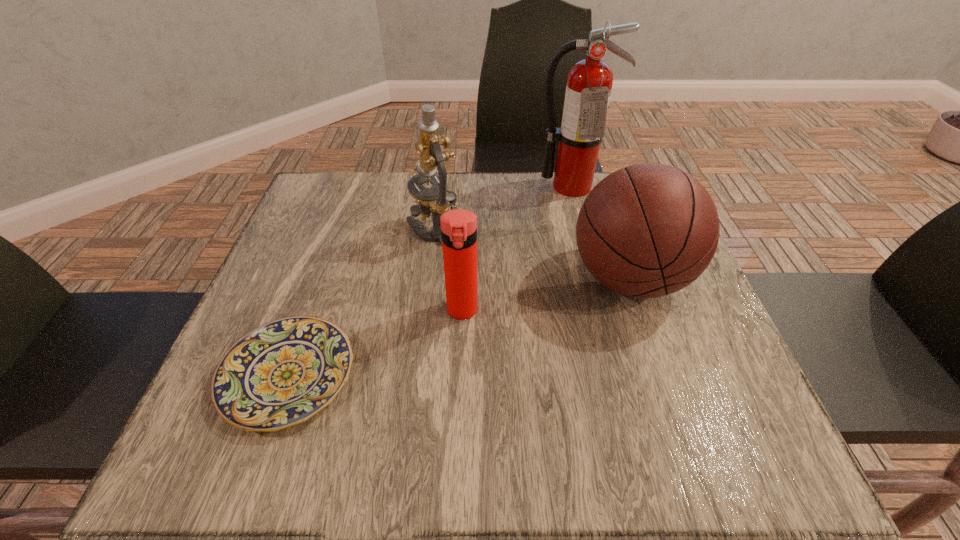
Find the location of a particular element. This screenshot has width=960, height=540. free point between the farthest object and the leftmost object is located at coordinates (429, 281).

This screenshot has width=960, height=540. Identify the location of blank region between the thermos bottle and the shortest object. (375, 343).

This screenshot has height=540, width=960. What are the coordinates of `free space between the thermos bottle and the basketball` in the screenshot? It's located at (545, 294).

The height and width of the screenshot is (540, 960). I want to click on free space between the tallest object and the leftmost object, so click(429, 281).

At what (x,y) coordinates should I click in order to perform the action: click on free space between the plate and the basketball. Please return your answer as a coordinate pair (x, y). This screenshot has width=960, height=540. Looking at the image, I should click on (459, 327).

Locate an element on the screen. free space between the basketball and the plate is located at coordinates click(459, 327).

Point out which object is positioned as the third nearest to the fourth shortest object. Please provide its 2D coordinates. Your answer should be formatted as a tuple, i.e. [(x, y)], where the tuple contains the x and y coordinates of a point satisfying the conditions above.

[(282, 373)]

The height and width of the screenshot is (540, 960). I want to click on object that is the fourth closest to the basketball, so click(x=282, y=373).

Where is `free space that satisfies the following two spatial constraints: 1. on the front side of the second tallest object; 2. on the right side of the thermos bottle`? This screenshot has width=960, height=540. free space that satisfies the following two spatial constraints: 1. on the front side of the second tallest object; 2. on the right side of the thermos bottle is located at coordinates (421, 310).

Image resolution: width=960 pixels, height=540 pixels. Identify the location of free space that satisfies the following two spatial constraints: 1. on the front side of the thermos bottle; 2. on the right side of the fourth shortest object. (421, 310).